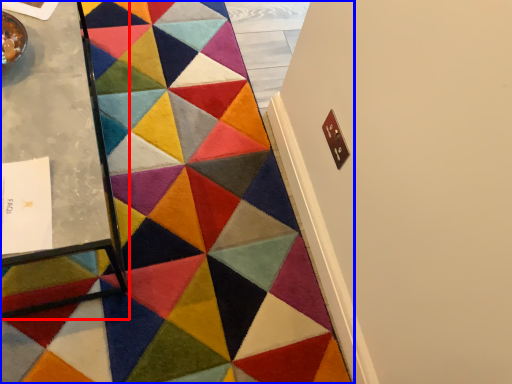
Question: Among these objects, which one is nearest to the camera, table (highlighted by a red box) or mat (highlighted by a blue box)?

Choices:
 (A) table
 (B) mat

Answer: (A)